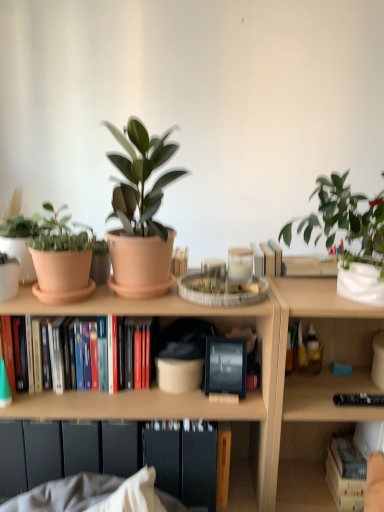
Question: Should I look upward or downward to see matte terracotta pot at center, the first houseplant in the left-to-right sequence?

Choices:
 (A) down
 (B) up

Answer: (B)

Question: Is matte terracotta pot at center, the first houseplant in the left-to-right sequence, positioned far away from hardcover book at lower right, marked as the 1th book in a bottom-to-top arrangement?

Choices:
 (A) yes
 (B) no

Answer: (B)

Question: From a real-world perspective, is matte terracotta pot at center, placed as the second houseplant when sorted from right to left, on hardcover book at lower right, the 1th book in the right-to-left sequence?

Choices:
 (A) no
 (B) yes

Answer: (B)

Question: Is matte terracotta pot at center, which appears as the first houseplant when viewed from the front, closer to camera compared to hardcover book at lower right, marked as the 1th book in a bottom-to-top arrangement?

Choices:
 (A) no
 (B) yes

Answer: (B)

Question: Does matte terracotta pot at center, placed as the second houseplant when sorted from right to left, come behind hardcover book at lower right, placed as the second book when sorted from top to bottom?

Choices:
 (A) yes
 (B) no

Answer: (B)

Question: Is matte terracotta pot at center, the first houseplant in the left-to-right sequence, thinner than hardcover book at lower right, marked as the 1th book in a bottom-to-top arrangement?

Choices:
 (A) yes
 (B) no

Answer: (B)

Question: From the image's perspective, is matte terracotta pot at center, the first houseplant in the left-to-right sequence, located beneath hardcover book at lower right, the 1th book in the right-to-left sequence?

Choices:
 (A) no
 (B) yes

Answer: (A)

Question: Is white glossy pot at upper right, marked as the first houseplant in a right-to-left arrangement, bigger than hardcover book at lower right, the 1th book in the right-to-left sequence?

Choices:
 (A) yes
 (B) no

Answer: (A)

Question: Are white glossy pot at upper right, the 1th houseplant positioned from the back, and hardcover book at lower right, the 1th book in the right-to-left sequence, located far from each other?

Choices:
 (A) yes
 (B) no

Answer: (B)

Question: Does white glossy pot at upper right, which appears as the second houseplant when viewed from the front, turn towards hardcover book at lower right, positioned as the second book in left-to-right order?

Choices:
 (A) yes
 (B) no

Answer: (B)

Question: Is hardcover book at lower right, placed as the second book when sorted from top to bottom, a part of white glossy pot at upper right, which appears as the second houseplant when viewed from the front?

Choices:
 (A) no
 (B) yes

Answer: (A)

Question: From a real-world perspective, is white glossy pot at upper right, the second houseplant in the left-to-right sequence, located higher than hardcover book at lower right, placed as the second book when sorted from top to bottom?

Choices:
 (A) yes
 (B) no

Answer: (A)

Question: Considering the relative positions of white glossy pot at upper right, the 1th houseplant positioned from the back, and hardcover book at lower right, placed as the second book when sorted from top to bottom, in the image provided, is white glossy pot at upper right, the 1th houseplant positioned from the back, to the left of hardcover book at lower right, placed as the second book when sorted from top to bottom, from the viewer's perspective?

Choices:
 (A) yes
 (B) no

Answer: (A)

Question: Is white matte vase at upper right, the 1th flowerpot positioned from the right, thinner than hardcover books at center left, which is counted as the 1th book, starting from the top?

Choices:
 (A) no
 (B) yes

Answer: (A)